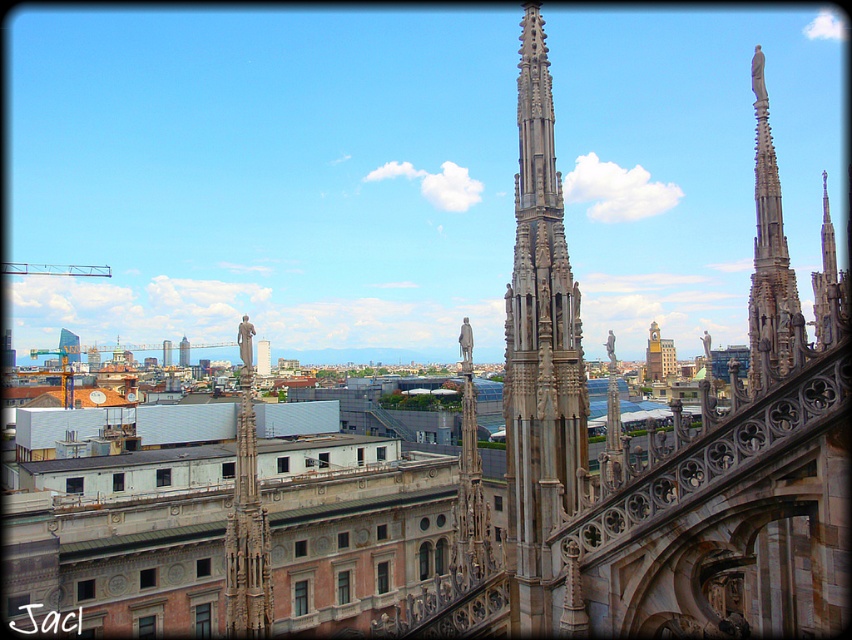
Question: Which object is positioned closest to the matte gray skyscraper at center?

Choices:
 (A) stone statue at center
 (B) gray stone spire at upper right
 (C) white matte building at center

Answer: (C)

Question: Is stone spire at center bigger than gray stone spire at upper right?

Choices:
 (A) yes
 (B) no

Answer: (B)

Question: Can you confirm if stone spire at center is thinner than matte gray skyscraper at center?

Choices:
 (A) yes
 (B) no

Answer: (A)

Question: Estimate the real-world distances between objects in this image. Which object is closer to the matte gray tower at center?

Choices:
 (A) gray stone spire at upper right
 (B) matte gray skyscraper at center
 (C) white matte building at center

Answer: (B)

Question: Which point is farther to the camera?

Choices:
 (A) click(524, 232)
 (B) click(162, 356)

Answer: (B)

Question: Is stone spire at center above matte gray tower at center?

Choices:
 (A) no
 (B) yes

Answer: (B)